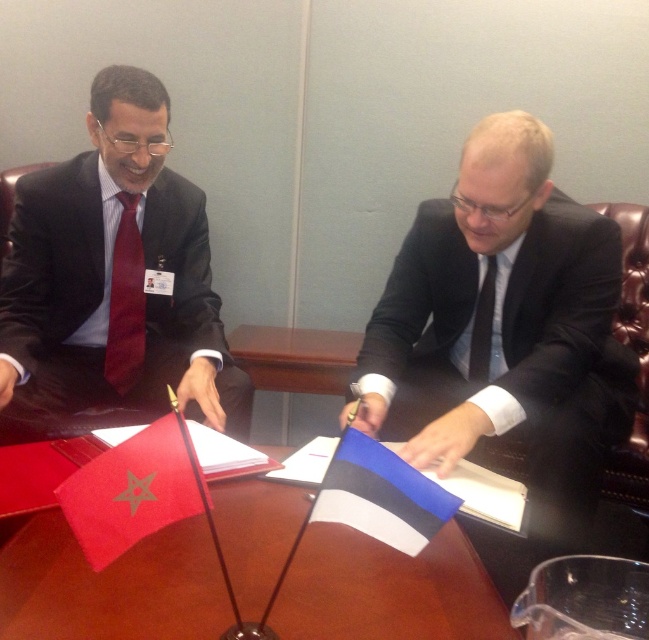
Does matte black suit at left have a greater height compared to matte red tie at left?

Yes.

Locate an element on the screen. matte black suit at left is located at coordinates (114, 278).

Does red fabric flag at center have a larger size compared to matte red tie at left?

No.

Which is more to the right, red fabric flag at center or matte red tie at left?

red fabric flag at center is more to the right.

Who is more forward, (134,531) or (116,269)?

Positioned in front is point (134,531).

Where is `red fabric flag at center`? The width and height of the screenshot is (649, 640). red fabric flag at center is located at coordinates (132, 490).

Does red fabric flag at center have a larger size compared to black silk tie at right?

Indeed, red fabric flag at center has a larger size compared to black silk tie at right.

Is red fabric flag at center thinner than black silk tie at right?

In fact, red fabric flag at center might be wider than black silk tie at right.

What do you see at coordinates (132, 490) in the screenshot? This screenshot has width=649, height=640. I see `red fabric flag at center` at bounding box center [132, 490].

Locate an element on the screen. This screenshot has width=649, height=640. red fabric flag at center is located at coordinates pyautogui.click(x=132, y=490).